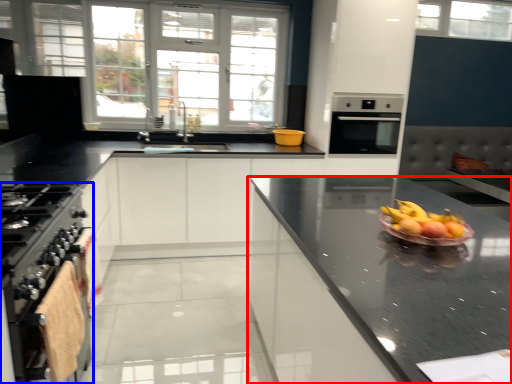
Question: Among these objects, which one is nearest to the camera, cabinetry (highlighted by a red box) or kitchen appliance (highlighted by a blue box)?

Choices:
 (A) cabinetry
 (B) kitchen appliance

Answer: (A)